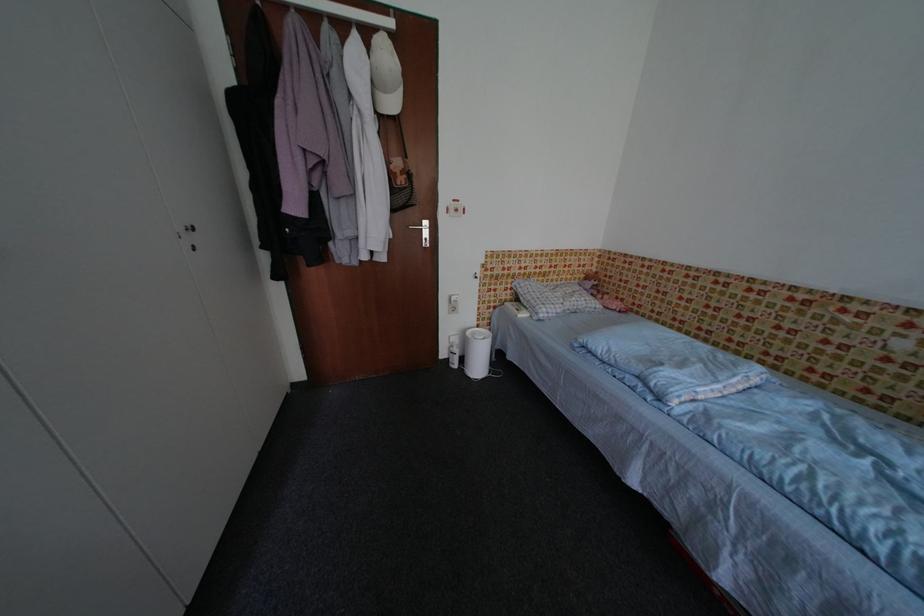
The height and width of the screenshot is (616, 924). In order to click on white baseball cap in this screenshot , I will do `click(385, 75)`.